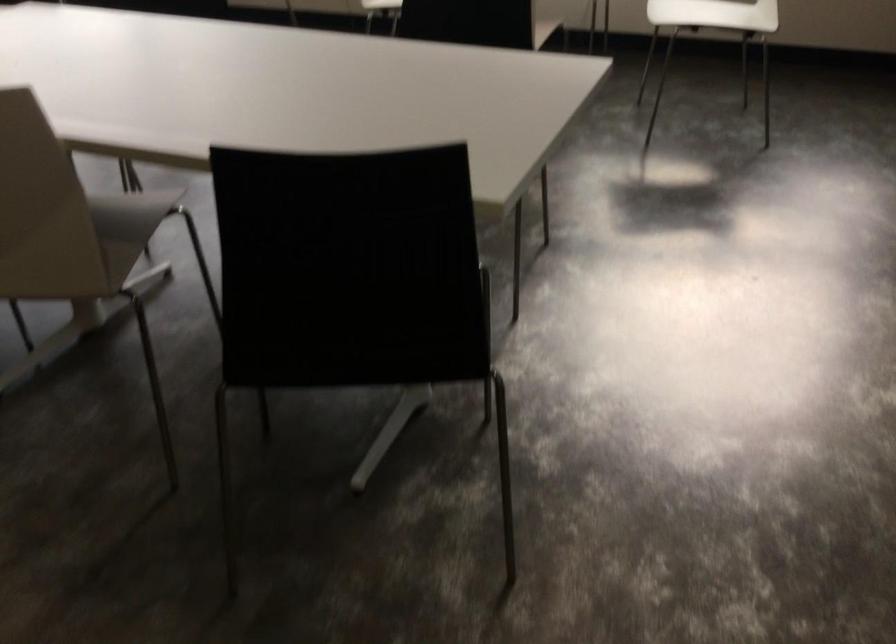
The image size is (896, 644). What do you see at coordinates (127, 227) in the screenshot?
I see `a white chair sitting surface` at bounding box center [127, 227].